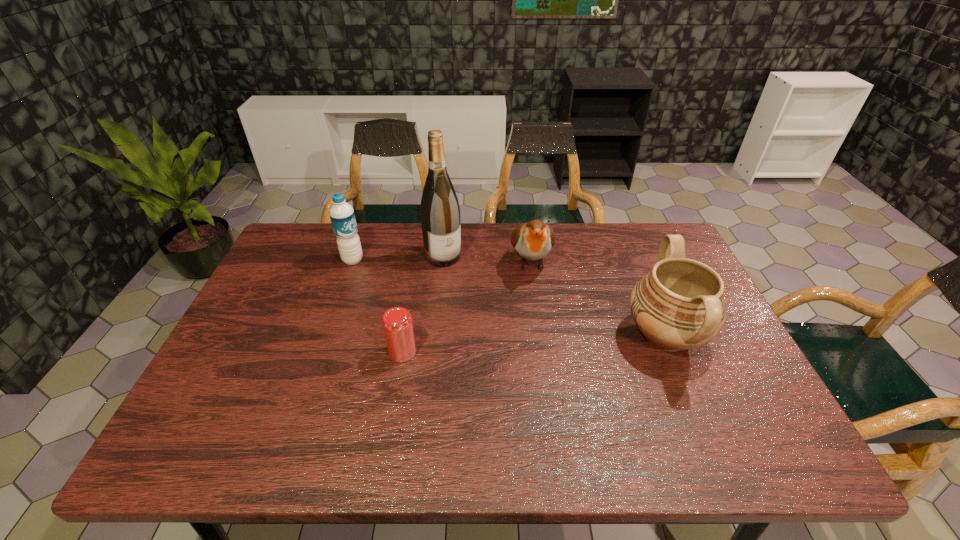
You are a GUI agent. You are given a task and a screenshot of the screen. Output one action in this format:
    pyautogui.click(x=<x>, y=<y>)
    Task: Click on the vacant position located 0.070m on the label of the wine bottle
    The width and height of the screenshot is (960, 540).
    Given the screenshot: What is the action you would take?
    pyautogui.click(x=462, y=280)

I want to click on free space located 0.340m on the label of the wine bottle, so click(510, 339).

Locate an element on the screen. The image size is (960, 540). free point located on the label of the wine bottle is located at coordinates (460, 278).

The width and height of the screenshot is (960, 540). Identify the location of free space located on the label of the water bottle. (403, 289).

Where is `free location located 0.100m on the label of the water bottle`? This screenshot has width=960, height=540. free location located 0.100m on the label of the water bottle is located at coordinates (382, 278).

Identify the location of blank area located on the label of the water bottle. (449, 317).

In order to click on vacant space situated at the face of the fourth tallest object in this screenshot , I will do `click(538, 330)`.

Where is `free space located 0.120m at the face of the fourth tallest object`? The image size is (960, 540). free space located 0.120m at the face of the fourth tallest object is located at coordinates (536, 317).

The height and width of the screenshot is (540, 960). Find the location of `free space located at the face of the fourth tallest object`. free space located at the face of the fourth tallest object is located at coordinates (543, 395).

The image size is (960, 540). In order to click on wine bottle located in the far edge section of the desktop in this screenshot , I will do (440, 214).